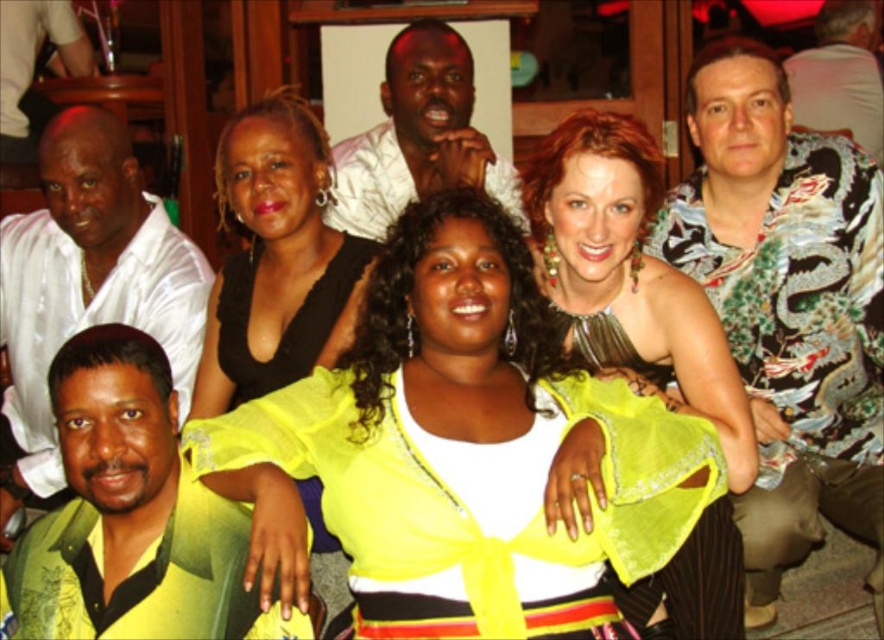
Question: Estimate the real-world distances between objects in this image. Which object is closer to the white satin shirt at upper left?

Choices:
 (A) shiny green fabric at center
 (B) green textured shirt at lower left
 (C) printed silk shirt at upper right

Answer: (B)

Question: Among these points, which one is farthest from the camera?

Choices:
 (A) (110, 246)
 (B) (286, 468)

Answer: (A)

Question: Can you confirm if black satin dress at upper center is bigger than white satin shirt at upper center?

Choices:
 (A) yes
 (B) no

Answer: (B)

Question: Does green textured shirt at lower left appear on the left side of printed silk shirt at upper right?

Choices:
 (A) yes
 (B) no

Answer: (A)

Question: Which of the following is the closest to the observer?

Choices:
 (A) white satin shirt at upper left
 (B) black satin dress at upper center

Answer: (B)

Question: Can you confirm if white satin shirt at upper left is bigger than white satin shirt at upper center?

Choices:
 (A) no
 (B) yes

Answer: (B)